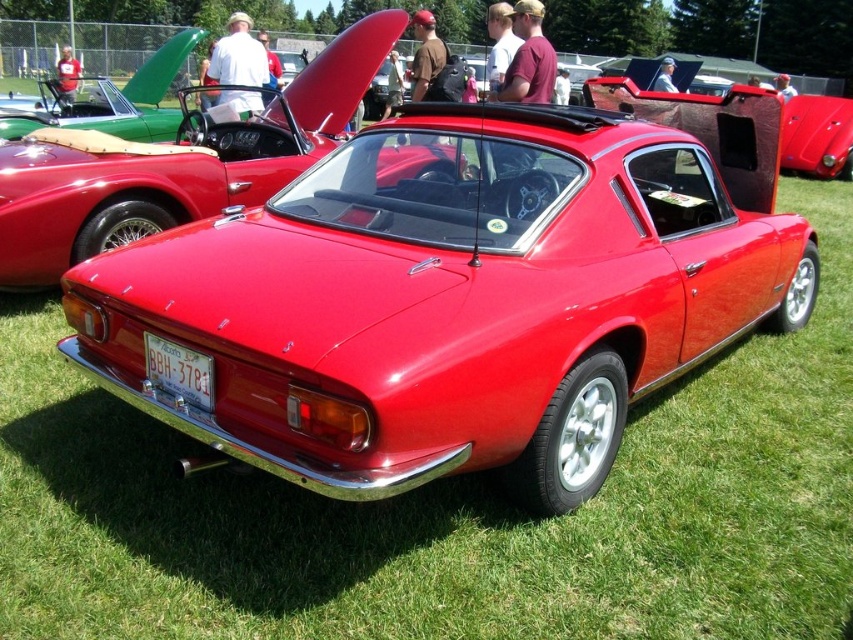
You are a photographer planning to take a wide shot of both the glossy red car at center and the glossy red convertible at center. Given that your camera can only capture objects up to the width of the wider vehicle, which vehicle should you position closer to the camera to ensure both fit in the frame?

The glossy red car at center has a smaller width than the glossy red convertible at center. To ensure both fit in the frame, position the glossy red car at center closer to the camera so that its apparent size matches the width of the glossy red convertible at center.

You are standing at the point marked by point (175, 163) in the image. Looking around, you see the glossy red car at center. Which direction should you face to look at the glossy red car at center?

You are already facing the glossy red car at center because the point (175, 163) marks its location.